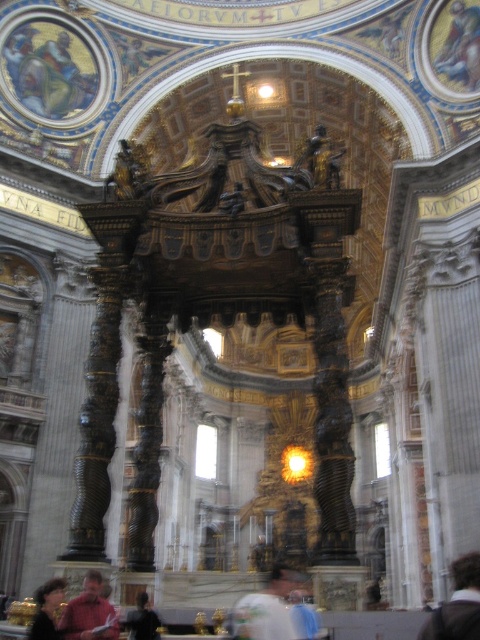
From the picture: You are standing inside the cathedral and want to know how far the point at coordinates point (61, 588) is from where you are standing. Can you determine the distance?

The distance of point (61, 588) from camera is 118.91 feet.

You are standing in the grand cathedral and want to take a photo of the ornate Baldachin. You notice two points marked in the image. The first point is at coordinate point (470, 630), and the second is at point (157, 621). Which point should you focus on to capture the Baldachin in the foreground of your photo?

You should focus on point (470, 630) because it is in front of point (157, 621), making it closer to the camera and thus ideal for placing the Baldachin in the foreground.

You are a tour guide standing in the cathedral and need to direct a visitor to a specific location. The visitor asks, which is closer to you, the red shirt at lower left or the dark brown hair at lower left? Please answer based on their distances from your current position.

The red shirt at lower left is 5.82 feet away from dark brown hair at lower left. Since both are at the same location, they are equally close to me.